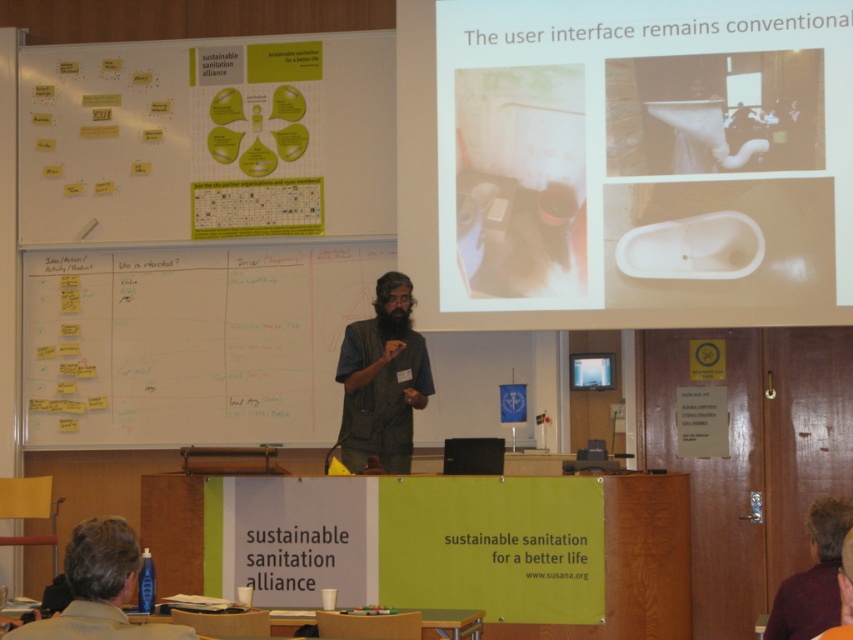
In the presentation scene, there is a man with brown hair at lower left and a maroon fabric shirt at lower right. Which of these two items is wider?

The brown hair at lower left is wider than the maroon fabric shirt at lower right.

You are an attendee at the presentation and notice two shirts in the background. Which shirt, the brown cotton shirt at center or the maroon fabric shirt at lower right, is located more to the left?

The brown cotton shirt at center is more to the left because it is positioned on the left side of the maroon fabric shirt at lower right.